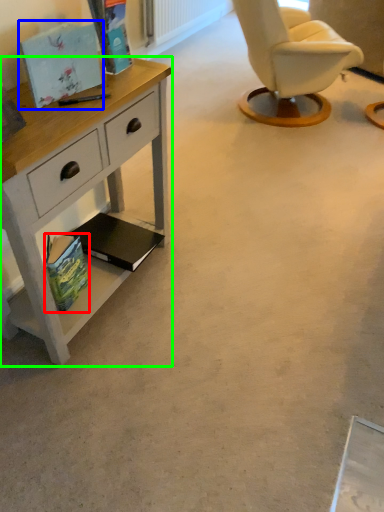
Question: Estimate the real-world distances between objects in this image. Which object is closer to magazine (highlighted by a red box), magazine (highlighted by a blue box) or desk (highlighted by a green box)?

Choices:
 (A) magazine
 (B) desk

Answer: (B)